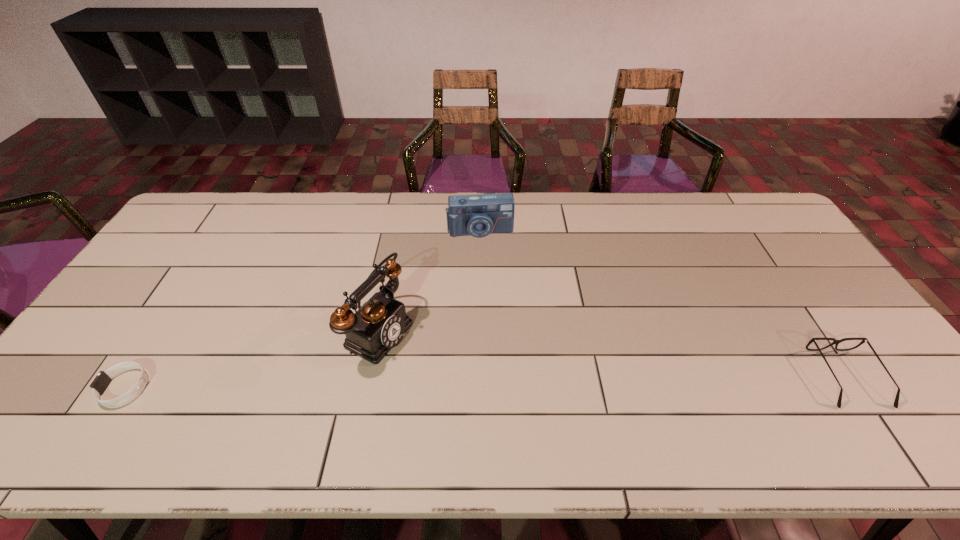
At what (x,y) coordinates should I click in order to perform the action: click on free space on the desktop that is between the shortest object and the spectacles and is positioned on the lens of the camera. Please return your answer as a coordinate pair (x, y). Looking at the image, I should click on (498, 383).

What are the coordinates of `free space on the desktop that is between the shortest object and the second shortest object and is positioned on the front of the telephone at the rotary dial` in the screenshot? It's located at (487, 383).